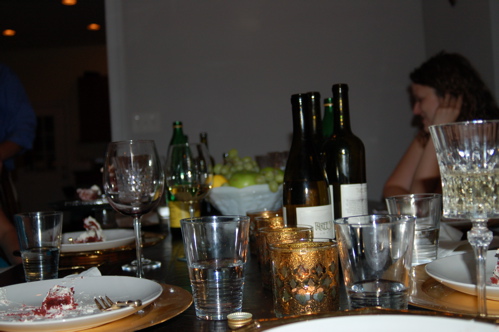
At what (x,y) coordinates should I click in order to perform the action: click on white fruit bowl. Please return your answer as a coordinate pair (x, y). Looking at the image, I should click on (245, 198).